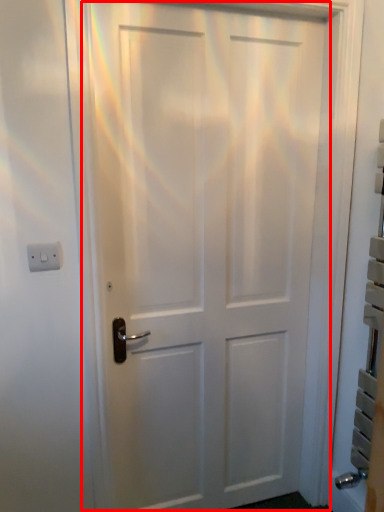
Question: From the image's perspective, where is door (annotated by the red box) located relative to light switch?

Choices:
 (A) below
 (B) above

Answer: (A)